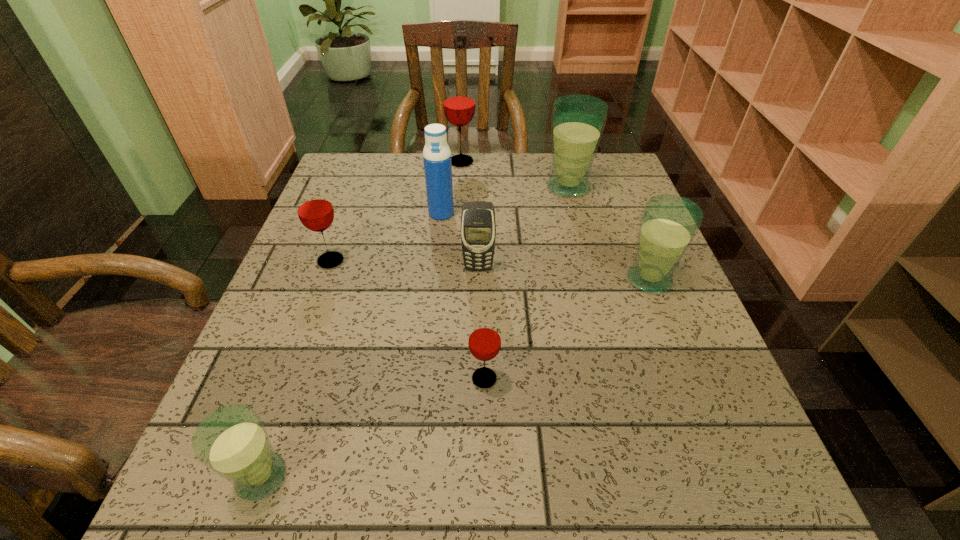
The image size is (960, 540). Identify the location of free space between the second object from right to left and the cellular telephone. coord(523,227).

The image size is (960, 540). In order to click on vacant area that lies between the water bottle and the cellular telephone in this screenshot , I will do `click(460, 240)`.

Find the location of `vacant point located between the second biggest blue glass and the water bottle`. vacant point located between the second biggest blue glass and the water bottle is located at coordinates (545, 246).

Where is `blank region between the second nearest object and the leftmost red glass`? This screenshot has height=540, width=960. blank region between the second nearest object and the leftmost red glass is located at coordinates (407, 320).

Identify the location of vacant point located between the third farthest object and the leftmost blue glass. (351, 345).

Find the location of a particular element. This screenshot has width=960, height=540. vacant area that lies between the second farthest glass and the second farthest blue glass is located at coordinates (609, 233).

Find the location of a particular element. This screenshot has width=960, height=540. empty location between the second farthest blue glass and the blue water bottle is located at coordinates (545, 246).

Where is `free spot between the second smallest blue glass and the second smallest red glass`? Image resolution: width=960 pixels, height=540 pixels. free spot between the second smallest blue glass and the second smallest red glass is located at coordinates (490, 270).

This screenshot has height=540, width=960. I want to click on vacant point located between the second smallest red glass and the cellular telephone, so click(404, 264).

Locate an element on the screen. The image size is (960, 540). object that is the third closest one to the cellular telephone is located at coordinates (315, 211).